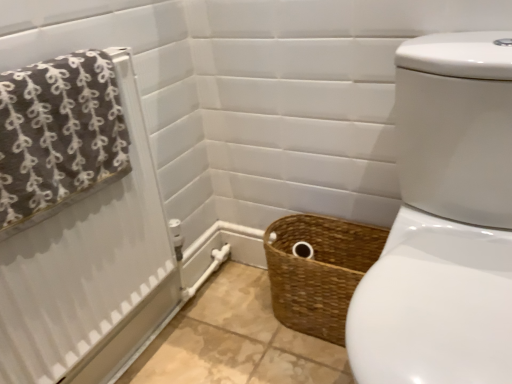
Question: Would you say brown woven basket at lower center is outside brown fabric towel at upper left?

Choices:
 (A) no
 (B) yes

Answer: (B)

Question: Could you tell me if brown woven basket at lower center is facing brown fabric towel at upper left?

Choices:
 (A) yes
 (B) no

Answer: (B)

Question: From a real-world perspective, is brown woven basket at lower center beneath brown fabric towel at upper left?

Choices:
 (A) no
 (B) yes

Answer: (B)

Question: Is brown woven basket at lower center to the right of brown fabric towel at upper left from the viewer's perspective?

Choices:
 (A) yes
 (B) no

Answer: (A)

Question: Is brown woven basket at lower center further to camera compared to brown fabric towel at upper left?

Choices:
 (A) yes
 (B) no

Answer: (A)

Question: Relative to brown fabric towel at upper left, is brown woven basket at lower center in front or behind?

Choices:
 (A) front
 (B) behind

Answer: (B)

Question: Does point (294, 266) appear closer or farther from the camera than point (59, 314)?

Choices:
 (A) farther
 (B) closer

Answer: (A)

Question: Is brown woven basket at lower center wider or thinner than brown fabric towel at upper left?

Choices:
 (A) wide
 (B) thin

Answer: (A)

Question: In the image, is brown woven basket at lower center on the left side or the right side of brown fabric towel at upper left?

Choices:
 (A) right
 (B) left

Answer: (A)

Question: From a real-world perspective, relative to brown fabric towel at upper left, is brown textured towel at left vertically above or below?

Choices:
 (A) above
 (B) below

Answer: (A)

Question: From the image's perspective, is brown textured towel at left located above or below brown fabric towel at upper left?

Choices:
 (A) above
 (B) below

Answer: (A)

Question: Is brown textured towel at left taller or shorter than brown fabric towel at upper left?

Choices:
 (A) tall
 (B) short

Answer: (B)

Question: Is brown textured towel at left to the left or to the right of brown fabric towel at upper left in the image?

Choices:
 (A) right
 (B) left

Answer: (B)

Question: Visually, is brown woven basket at lower center positioned to the left or to the right of brown textured towel at left?

Choices:
 (A) right
 (B) left

Answer: (A)

Question: Is point (318, 283) positioned closer to the camera than point (104, 82)?

Choices:
 (A) closer
 (B) farther

Answer: (B)